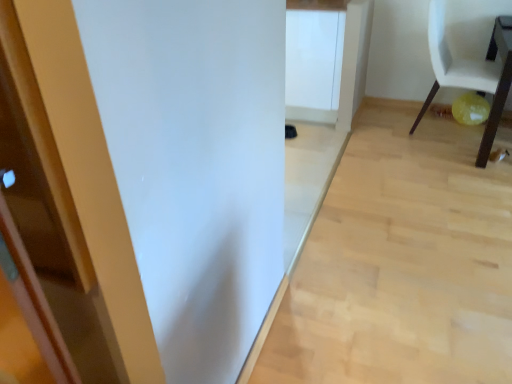
At what (x,y) coordinates should I click in order to perform the action: click on free region under white matte chair at right (from a real-world perspective). Please return your answer as a coordinate pair (x, y). The height and width of the screenshot is (384, 512). Looking at the image, I should click on (441, 128).